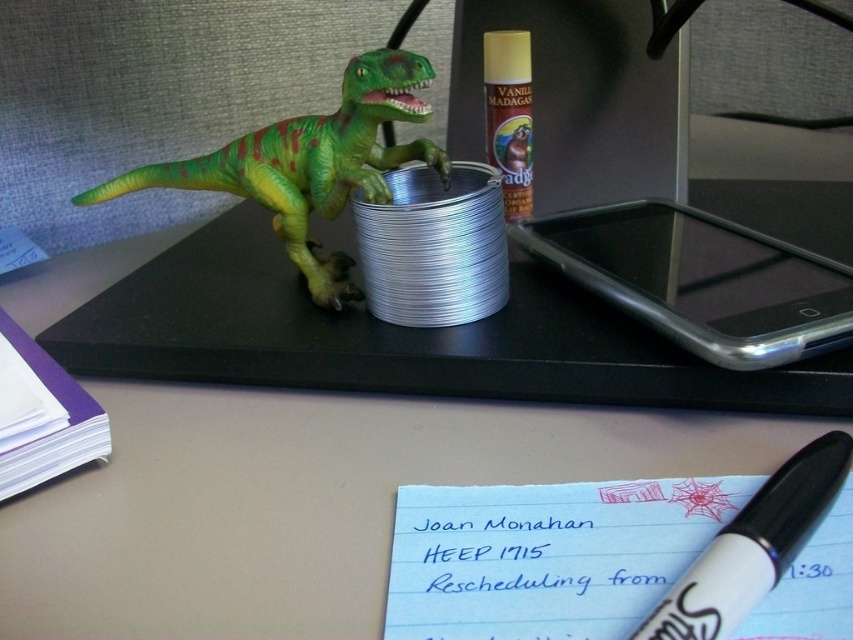
Question: Which of the following is the closest to the observer?

Choices:
 (A) (218, 163)
 (B) (846, 456)

Answer: (B)

Question: Can you confirm if green matte plastic dinosaur at upper left is positioned to the right of white marker pen at lower right?

Choices:
 (A) yes
 (B) no

Answer: (B)

Question: Does green matte plastic dinosaur at upper left appear on the right side of white marker pen at lower right?

Choices:
 (A) no
 (B) yes

Answer: (A)

Question: Is green matte plastic dinosaur at upper left positioned at the back of white marker pen at lower right?

Choices:
 (A) yes
 (B) no

Answer: (A)

Question: Among these objects, which one is nearest to the camera?

Choices:
 (A) green matte plastic dinosaur at upper left
 (B) white marker pen at lower right

Answer: (B)